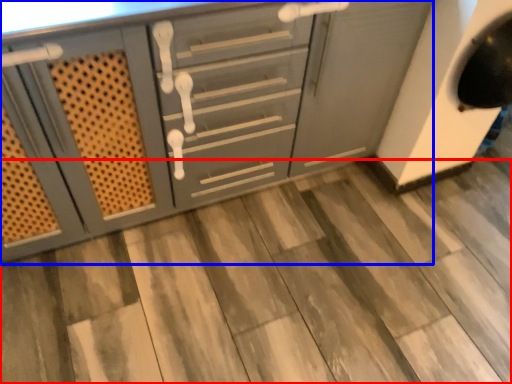
Question: Which object appears farthest to the camera in this image, tile (highlighted by a red box) or cabinetry (highlighted by a blue box)?

Choices:
 (A) tile
 (B) cabinetry

Answer: (A)